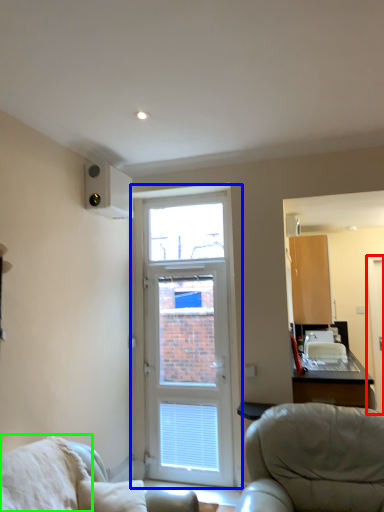
Question: Estimate the real-world distances between objects in this image. Which object is farther from screen door (highlighted by a red box), door (highlighted by a blue box) or pillow (highlighted by a green box)?

Choices:
 (A) door
 (B) pillow

Answer: (B)